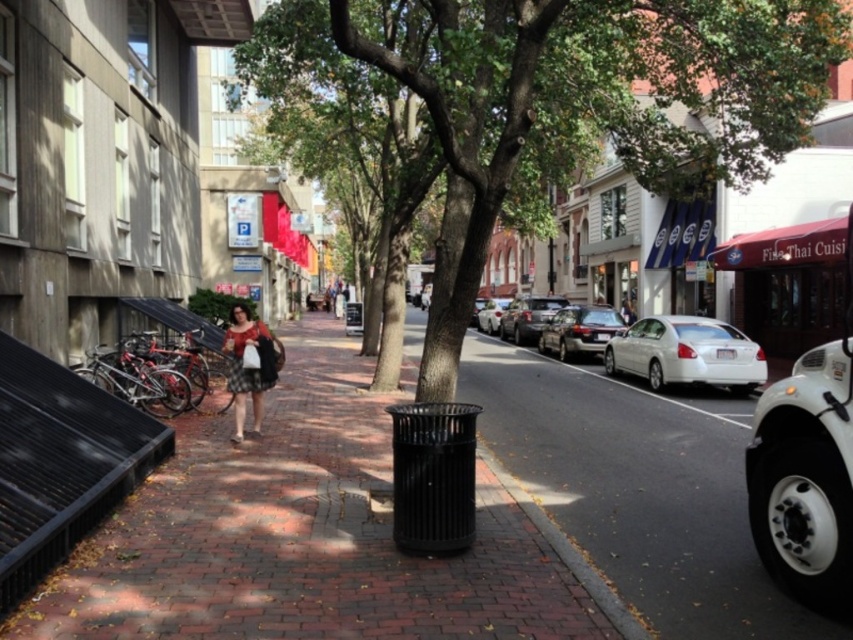
Which is below, black metal trash can at center or shiny silver sedan at center?

Positioned lower is black metal trash can at center.

Which is behind, point (280, 451) or point (524, 333)?

The point (524, 333) is behind.

Identify the location of black metal trash can at center. This screenshot has width=853, height=640. pyautogui.click(x=314, y=538).

Is black metal trash can at center shorter than white matte car at center?

Indeed, black metal trash can at center has a lesser height compared to white matte car at center.

Who is lower down, black metal trash can at center or white matte car at center?

black metal trash can at center

The height and width of the screenshot is (640, 853). I want to click on black metal trash can at center, so click(x=314, y=538).

Identify the location of black metal trash can at center. (x=314, y=538).

Is black metal trash can at center positioned behind green leafy tree at center?

No, it is in front of green leafy tree at center.

Does black metal trash can at center appear under green leafy tree at center?

Yes, black metal trash can at center is below green leafy tree at center.

Find the location of a particular element. black metal trash can at center is located at coordinates (314, 538).